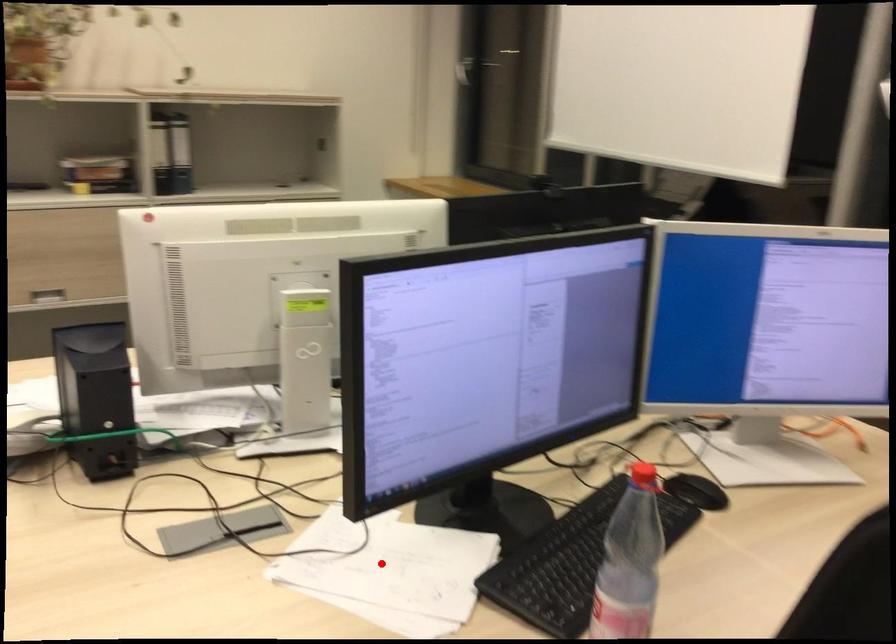
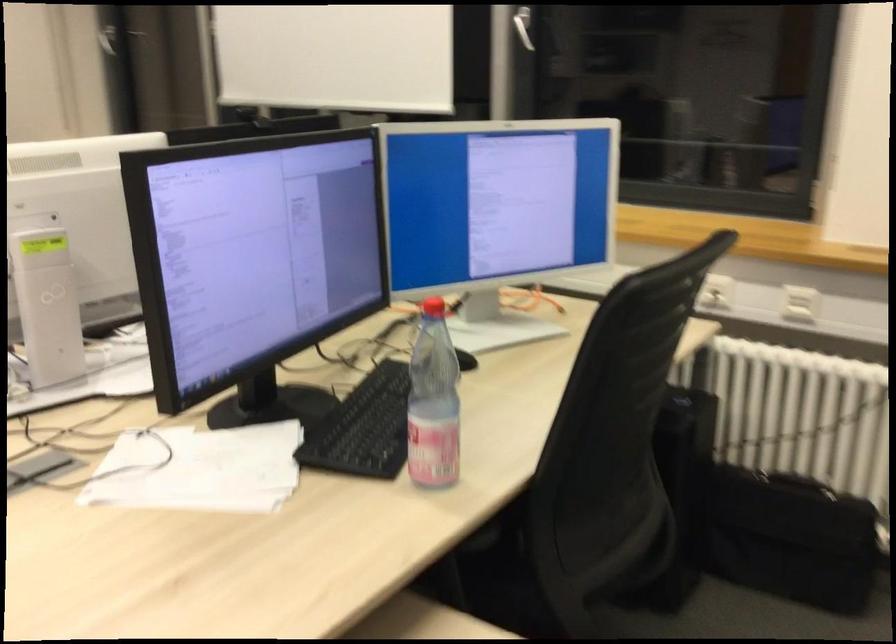
Locate, in the second image, the point that corresponds to the highlighted location in the first image.

(199, 469)